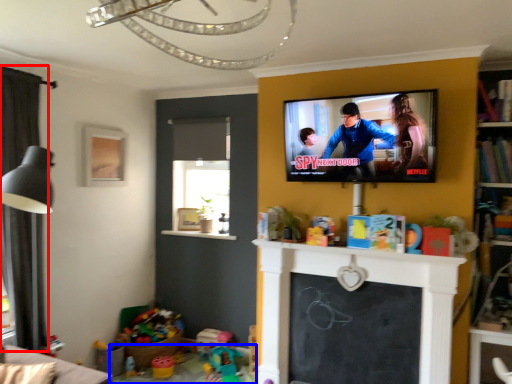
Question: Which object is closer to the camera taking this photo, curtain (highlighted by a red box) or table (highlighted by a blue box)?

Choices:
 (A) curtain
 (B) table

Answer: (A)